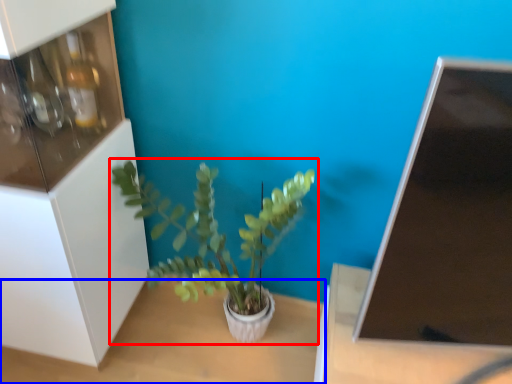
Question: Among these objects, which one is nearest to the camera, houseplant (highlighted by a red box) or table (highlighted by a blue box)?

Choices:
 (A) houseplant
 (B) table

Answer: (A)